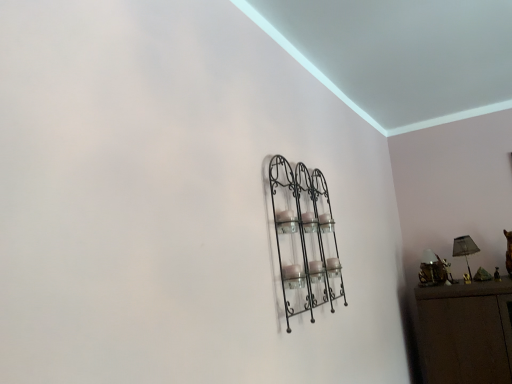
Question: Is metallic gold lamp at right thinner than black wrought iron shelf at center?

Choices:
 (A) yes
 (B) no

Answer: (B)

Question: Is metallic gold lamp at right looking in the opposite direction of black wrought iron shelf at center?

Choices:
 (A) no
 (B) yes

Answer: (A)

Question: From a real-world perspective, is metallic gold lamp at right positioned over black wrought iron shelf at center based on gravity?

Choices:
 (A) yes
 (B) no

Answer: (B)

Question: Is metallic gold lamp at right wider than black wrought iron shelf at center?

Choices:
 (A) yes
 (B) no

Answer: (A)

Question: Can you confirm if metallic gold lamp at right is positioned to the right of black wrought iron shelf at center?

Choices:
 (A) no
 (B) yes

Answer: (B)

Question: Choose the correct answer: Is black wrought iron shelf at center inside matte black lampshade at right or outside it?

Choices:
 (A) outside
 (B) inside

Answer: (A)

Question: From a real-world perspective, is black wrought iron shelf at center physically located above or below matte black lampshade at right?

Choices:
 (A) below
 (B) above

Answer: (B)

Question: Does point tap(289, 241) appear closer or farther from the camera than point tap(473, 248)?

Choices:
 (A) farther
 (B) closer

Answer: (B)

Question: Is black wrought iron shelf at center wider or thinner than matte black lampshade at right?

Choices:
 (A) thin
 (B) wide

Answer: (A)

Question: Relative to black wrought iron shelf at center, is metallic gold lamp at right in front or behind?

Choices:
 (A) front
 (B) behind

Answer: (B)

Question: In terms of height, does metallic gold lamp at right look taller or shorter compared to black wrought iron shelf at center?

Choices:
 (A) short
 (B) tall

Answer: (A)

Question: From the image's perspective, relative to black wrought iron shelf at center, is metallic gold lamp at right above or below?

Choices:
 (A) above
 (B) below

Answer: (B)

Question: Which is correct: metallic gold lamp at right is inside black wrought iron shelf at center, or outside of it?

Choices:
 (A) outside
 (B) inside

Answer: (A)

Question: From their relative heights in the image, would you say black wrought iron shelf at center is taller or shorter than metallic gold lamp at right?

Choices:
 (A) short
 (B) tall

Answer: (B)

Question: From a real-world perspective, is black wrought iron shelf at center physically located above or below metallic gold lamp at right?

Choices:
 (A) below
 (B) above

Answer: (B)